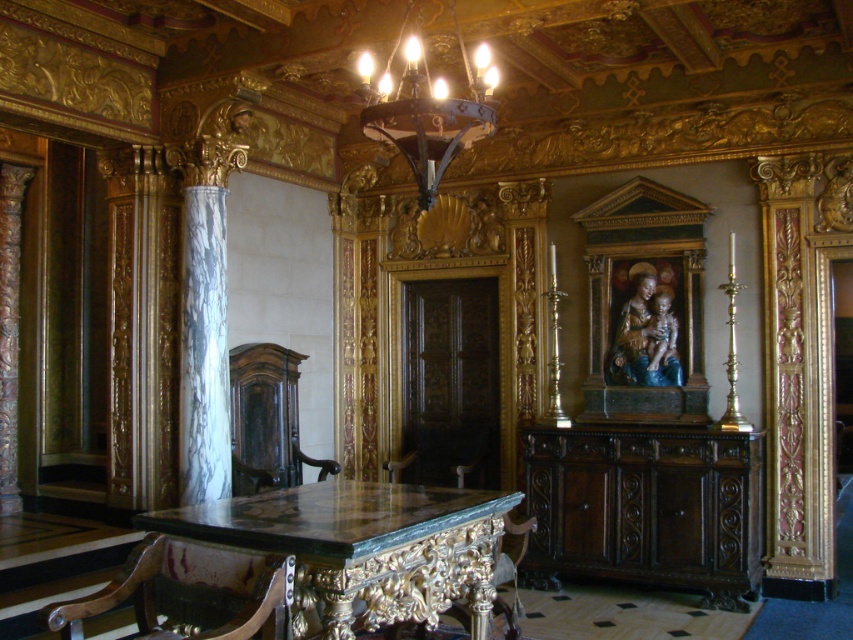
You are an interior designer planning to place a large rectangular rug in this room. The rug must be placed under the green marble table at center and centered under the dark bronze chandelier at upper center. Considering their widths, which object will require a wider rug to accommodate its width?

The green marble table at center requires a wider rug because its width surpasses that of the dark bronze chandelier at upper center.

You are an interior designer planning to install a new lighting fixture between the green marble table at center and the dark bronze chandelier at upper center. The fixture requires a minimum of 6 feet of clearance between it and any existing fixtures. Based on the current spacing, is this installation feasible?

The green marble table at center and dark bronze chandelier at upper center are 5.71 feet apart, which is less than the required 6 feet clearance. Therefore, installing the new lighting fixture between them would not meet the clearance requirement.